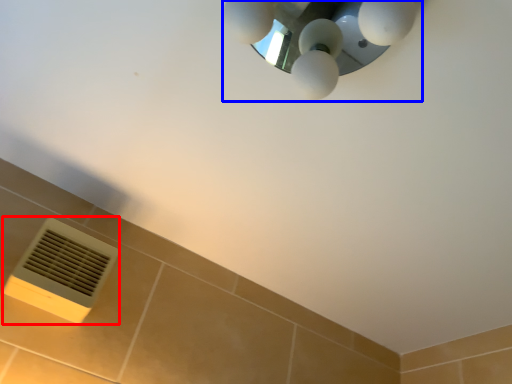
Question: Among these objects, which one is nearest to the camera, air conditioning (highlighted by a red box) or lamp (highlighted by a blue box)?

Choices:
 (A) air conditioning
 (B) lamp

Answer: (B)